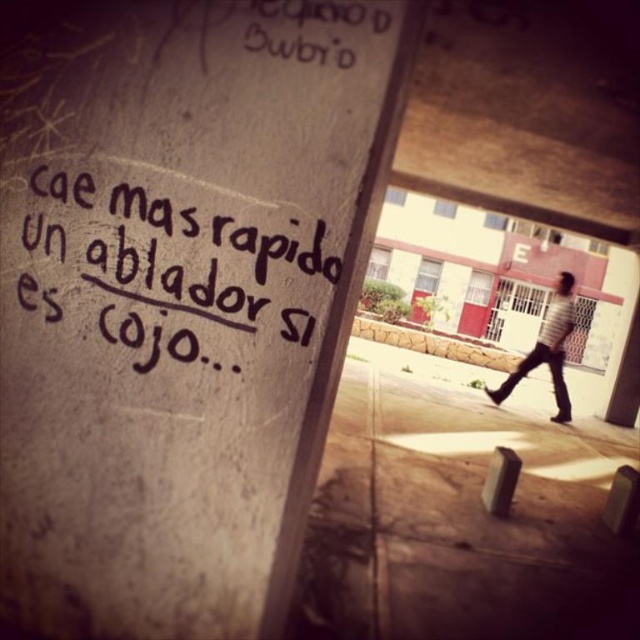
Can you confirm if black painted concrete sign at upper left is positioned to the right of striped shirt at right?

Incorrect, black painted concrete sign at upper left is not on the right side of striped shirt at right.

Which is more to the right, black painted concrete sign at upper left or striped shirt at right?

striped shirt at right

Between point (216, 515) and point (568, 333), which one is positioned in front?

Point (216, 515) is more forward.

Where is `black painted concrete sign at upper left`? The height and width of the screenshot is (640, 640). black painted concrete sign at upper left is located at coordinates (179, 296).

Who is positioned more to the left, black handwritten text at center or striped shirt at right?

From the viewer's perspective, black handwritten text at center appears more on the left side.

Who is more distant from viewer, (292, 307) or (557, 387)?

The point (557, 387) is behind.

Between point (109, 205) and point (541, 346), which one is positioned in front?

Positioned in front is point (109, 205).

Find the location of a particular element. black handwritten text at center is located at coordinates 176,248.

Is black painted concrete sign at upper left closer to the viewer compared to black handwritten text at center?

Yes, it is in front of black handwritten text at center.

Who is higher up, black painted concrete sign at upper left or black handwritten text at center?

black handwritten text at center is above.

What do you see at coordinates (179, 296) in the screenshot?
I see `black painted concrete sign at upper left` at bounding box center [179, 296].

This screenshot has width=640, height=640. I want to click on black painted concrete sign at upper left, so click(179, 296).